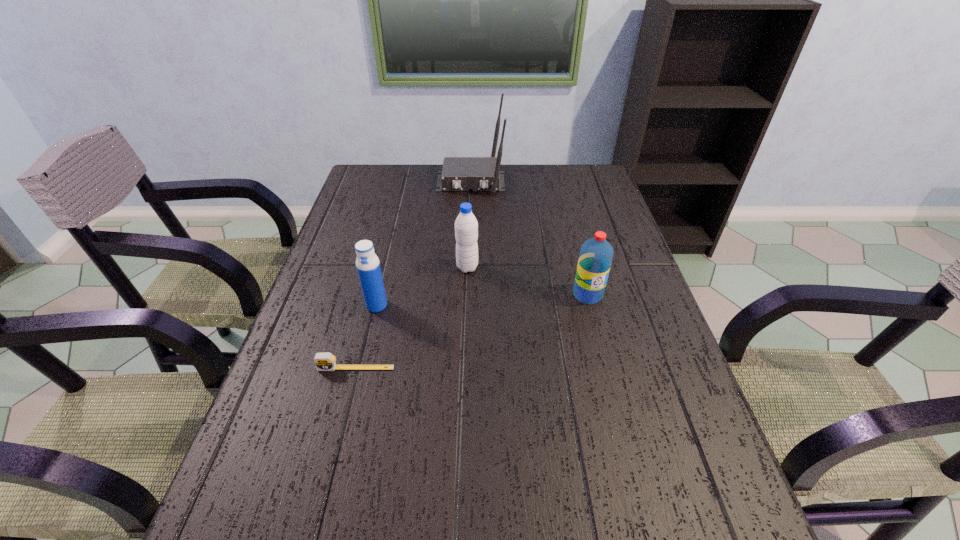
Identify the location of the farthest object. (459, 173).

In order to click on the tallest object in this screenshot , I will do tap(459, 173).

Identify the location of the second farthest object. (466, 226).

At what (x,y) coordinates should I click in order to perform the action: click on the farthest water bottle. Please return your answer as a coordinate pair (x, y). The height and width of the screenshot is (540, 960). Looking at the image, I should click on [x=466, y=226].

Image resolution: width=960 pixels, height=540 pixels. What are the coordinates of `the rightmost water bottle` in the screenshot? It's located at (596, 254).

You are a GUI agent. You are given a task and a screenshot of the screen. Output one action in this format:
    pyautogui.click(x=<x>, y=<y>)
    Task: Click on the leftmost water bottle
    
    Given the screenshot: What is the action you would take?
    pyautogui.click(x=368, y=267)

The width and height of the screenshot is (960, 540). Identify the location of the shortest object. (325, 361).

At what (x,y) coordinates should I click in order to perform the action: click on the nearest object. Please return your answer as a coordinate pair (x, y). The height and width of the screenshot is (540, 960). Looking at the image, I should click on (325, 361).

Find the location of `free spot located 0.290m on the back of the tallest object to connect cables`. free spot located 0.290m on the back of the tallest object to connect cables is located at coordinates (468, 253).

The height and width of the screenshot is (540, 960). I want to click on free space located on the front of the farthest water bottle, so click(x=465, y=341).